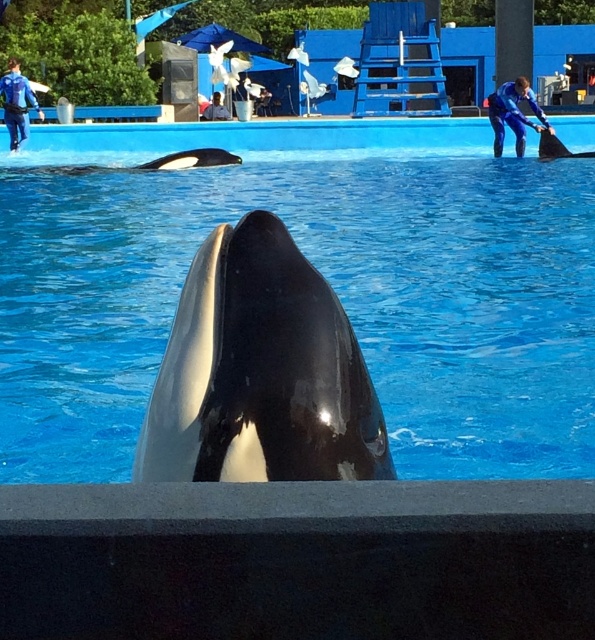
You are a marine biologist observing the orcas in the pool. You notice the blue smooth water at center and the black glossy whale at center. Which of these two is positioned higher in the image?

The blue smooth water at center is above the black glossy whale at center, so the blue smooth water at center is positioned higher in the image.

You are a marine biologist observing the orcas in the marine park. You notice two animals in the pool. Which one is thinner between the black glossy whale at center and the black smooth dolphin at right?

Result: The black glossy whale at center is thinner than the black smooth dolphin at right according to the description.

You are a marine biologist observing the orcas in their pool. You notice the blue smooth water at center and the black glossy whale at center. Which of these two elements is wider in this scene?

The blue smooth water at center is wider than the black glossy whale at center according to the description provided.